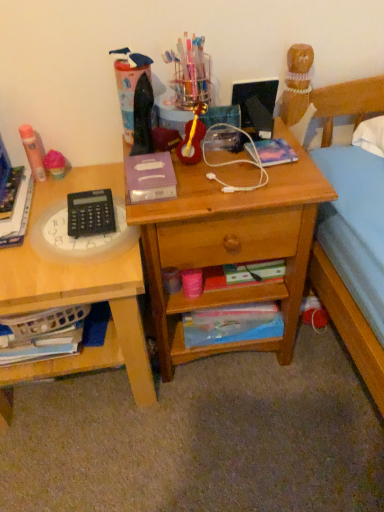
Find the location of a particular element. The width and height of the screenshot is (384, 512). free space to the right of purple matte paperback book at center, the 3th paperback book when ordered from back to front is located at coordinates (211, 183).